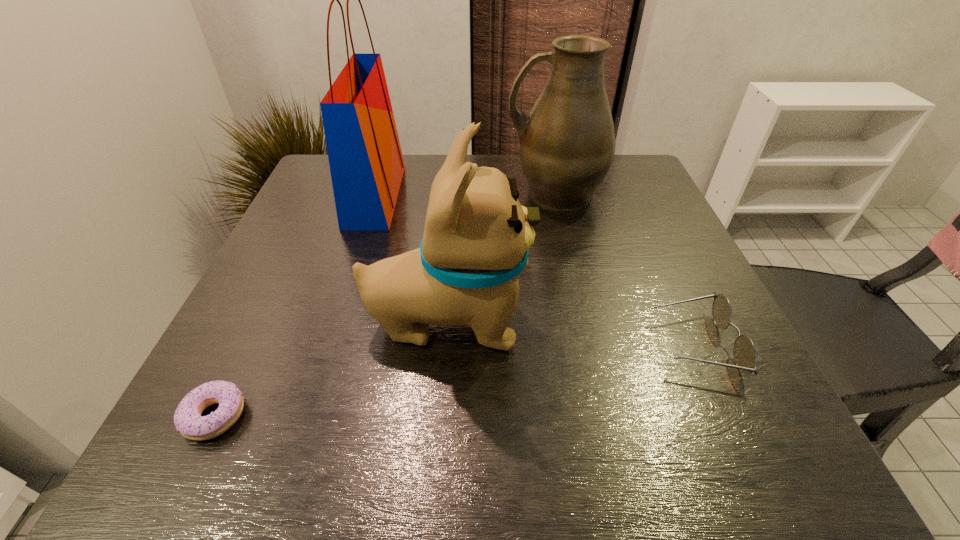
Image resolution: width=960 pixels, height=540 pixels. I want to click on vacant position located on the handle side of the pitcher, so [432, 193].

Where is `vacant space located 0.370m on the front-facing side of the spectacles`? vacant space located 0.370m on the front-facing side of the spectacles is located at coordinates (449, 344).

I want to click on vacant point located on the front-facing side of the spectacles, so click(x=602, y=344).

At what (x,y) coordinates should I click in order to perform the action: click on vacant position located on the front-facing side of the spectacles. Please return your answer as a coordinate pair (x, y). The image size is (960, 540). Looking at the image, I should click on (608, 344).

I want to click on free space located on the back of the doughnut, so click(293, 254).

Where is `shopping bag that is at the far edge`? shopping bag that is at the far edge is located at coordinates (366, 163).

Find the location of `pitcher situated at the far edge`. pitcher situated at the far edge is located at coordinates (x=567, y=143).

You are a GUI agent. You are given a task and a screenshot of the screen. Output one action in this format:
    pyautogui.click(x=<x>, y=<y>)
    Task: Click on the object present at the near edge
    Image resolution: width=960 pixels, height=540 pixels.
    Given the screenshot: What is the action you would take?
    pyautogui.click(x=187, y=418)

You are a GUI agent. You are given a task and a screenshot of the screen. Output one action in this format:
    pyautogui.click(x=<x>, y=<y>)
    Task: Click on the shopping bag at the left edge
    This screenshot has height=540, width=960.
    Given the screenshot: What is the action you would take?
    pyautogui.click(x=366, y=163)

The height and width of the screenshot is (540, 960). I want to click on doughnut at the left edge, so click(x=187, y=418).